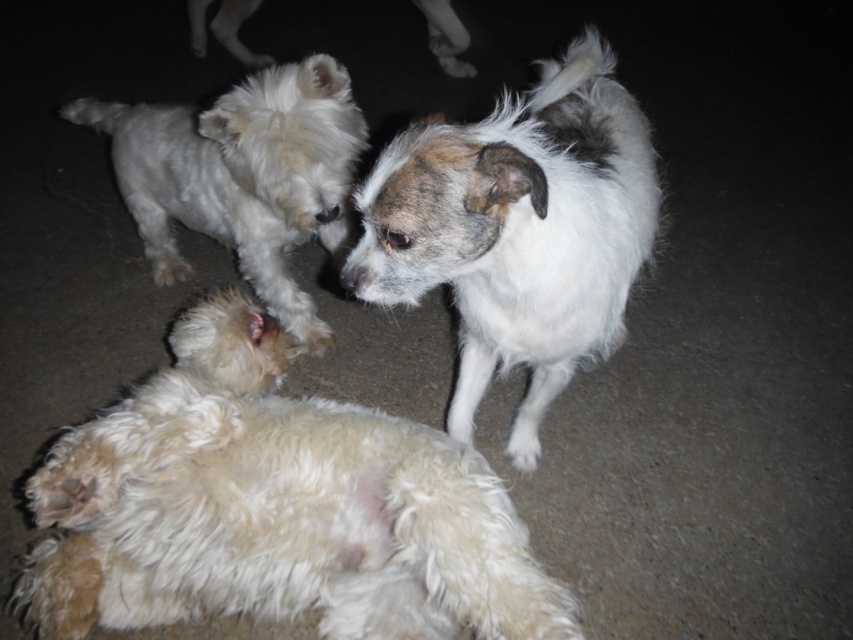
You are a photographer trying to capture a photo of the fluffy white dog at lower left and the white fluffy dog at center. Since the lighting is dim, you need to ensure both dogs are well within the camera frame. Based on their positions, which dog is closer to the bottom edge of the frame?

The fluffy white dog at lower left is located below the white fluffy dog at center, so it is closer to the bottom edge of the frame.

You are a photographer trying to capture a photo of the fluffy white dog at lower left. Based on its position coordinates, where should you aim your camera to ensure it is centered in the frame?

To center the fluffy white dog at lower left in the frame, aim your camera at its position coordinates at point [274,508].